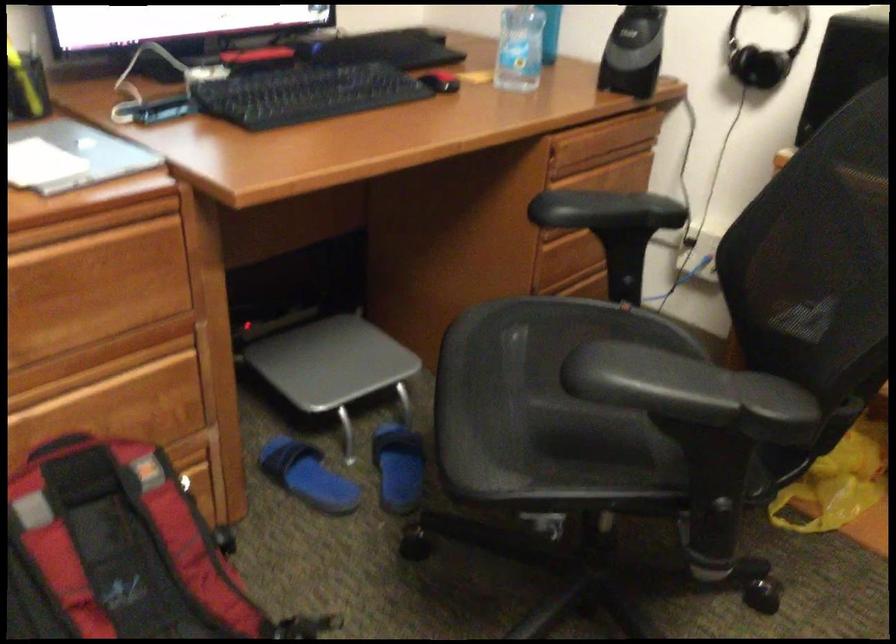
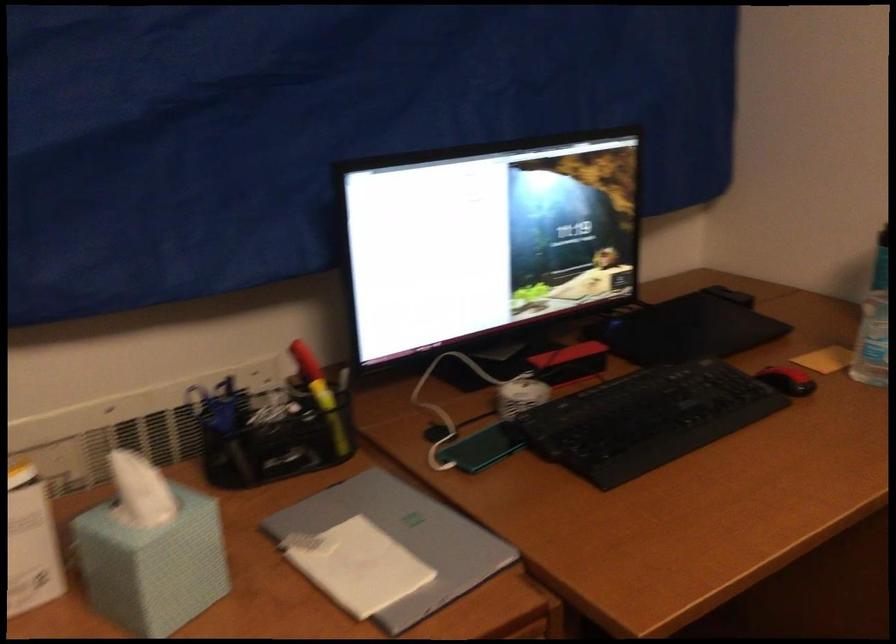
The point at (440,77) is marked in the first image. Where is the corresponding point in the second image?

(787, 380)